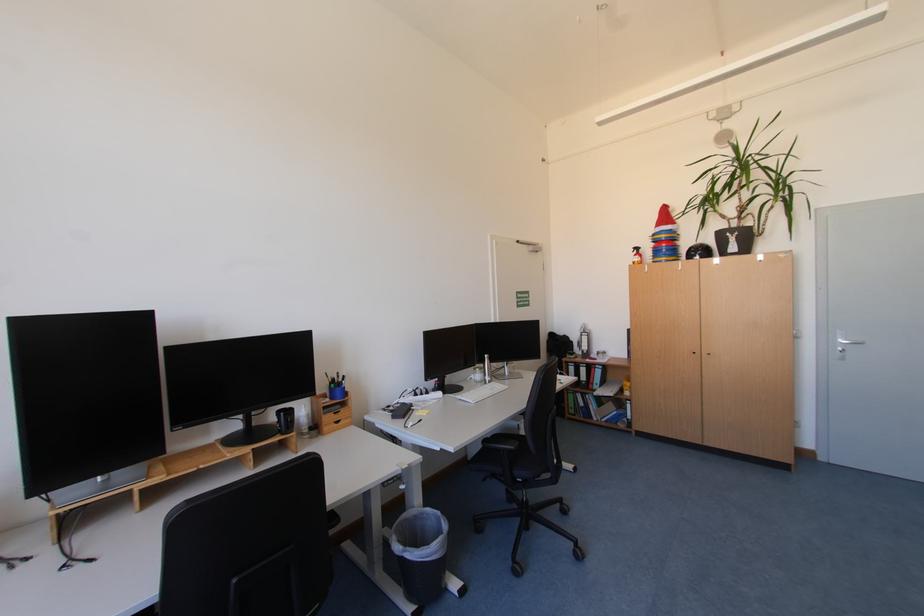
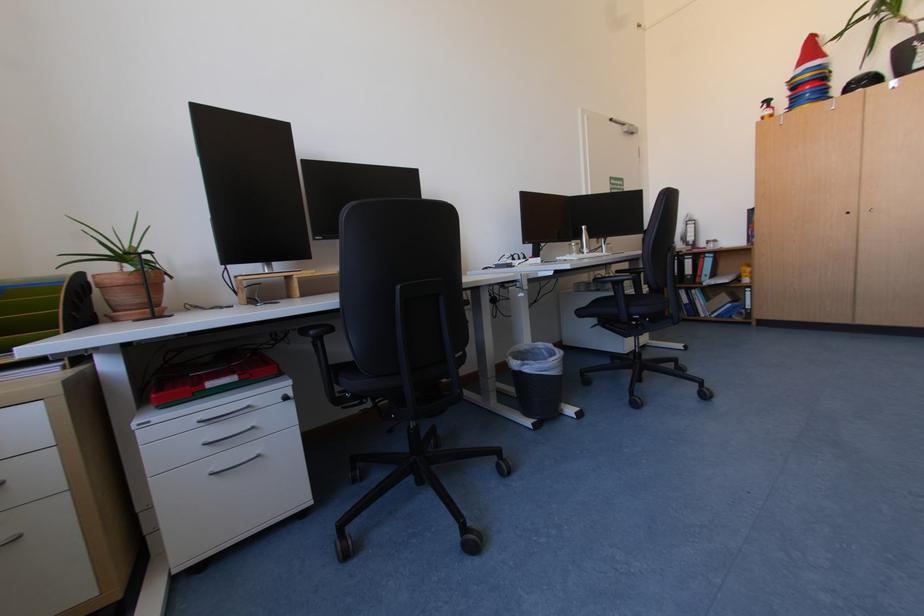
Question: What movement of the cameraman would produce the second image?

Choices:
 (A) Left
 (B) Right
 (C) Forward
 (D) Backward

Answer: (A)